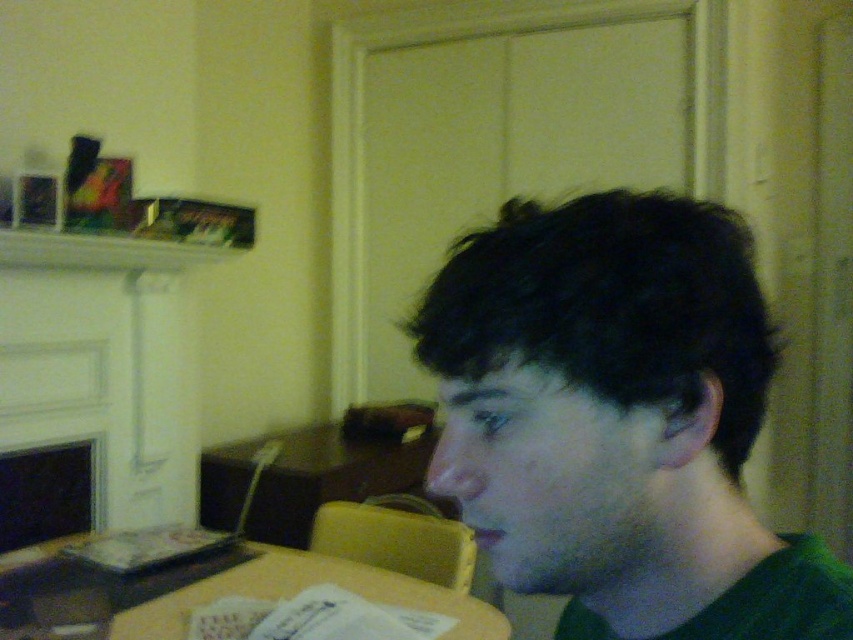
In the scene shown: Is dark green hair at center smaller than matte black fireplace at lower left?

Incorrect, dark green hair at center is not smaller in size than matte black fireplace at lower left.

Does dark green hair at center come behind matte black fireplace at lower left?

No.

Which is in front, point (793, 557) or point (4, 490)?

Point (793, 557) is more forward.

Image resolution: width=853 pixels, height=640 pixels. What are the coordinates of `dark green hair at center` in the screenshot? It's located at (618, 420).

Which of these two, wooden table at lower center or matte black fireplace at lower left, stands shorter?

With less height is wooden table at lower center.

Based on the photo, is wooden table at lower center closer to the viewer compared to matte black fireplace at lower left?

Yes, it is in front of matte black fireplace at lower left.

Who is more forward, (x=399, y=579) or (x=74, y=516)?

Point (x=399, y=579)

Locate an element on the screen. wooden table at lower center is located at coordinates (297, 593).

Does dark green hair at center appear over wooden table at lower center?

Yes, dark green hair at center is above wooden table at lower center.

Who is positioned more to the left, dark green hair at center or wooden table at lower center?

Positioned to the left is wooden table at lower center.

Is point (518, 452) positioned after point (123, 620)?

That is False.

I want to click on dark green hair at center, so click(618, 420).